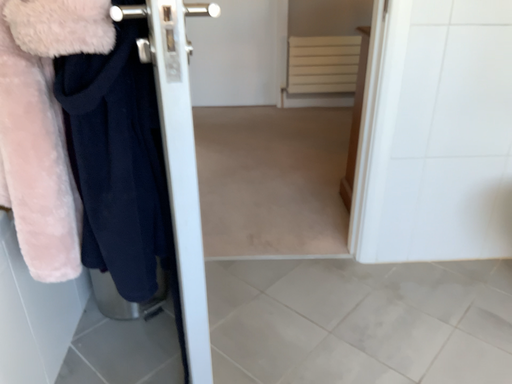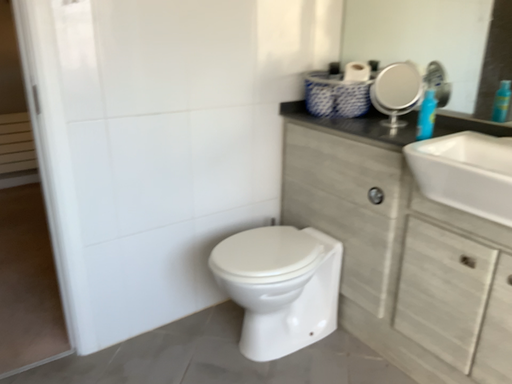
Question: Which way did the camera rotate in the video?

Choices:
 (A) rotated upward
 (B) rotated downward

Answer: (A)